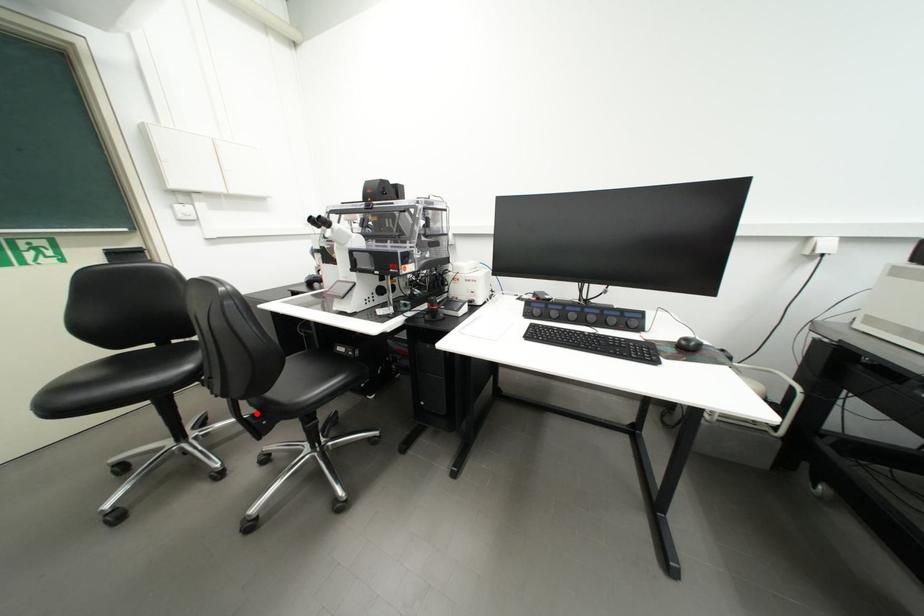
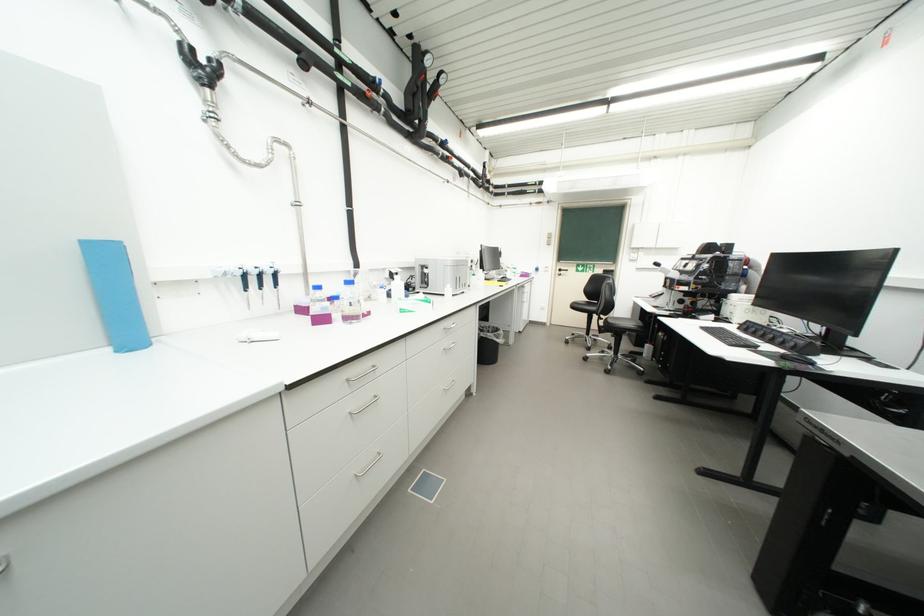
Where in the second image is the point corresponding to the highlighted location from the first image?

(610, 325)